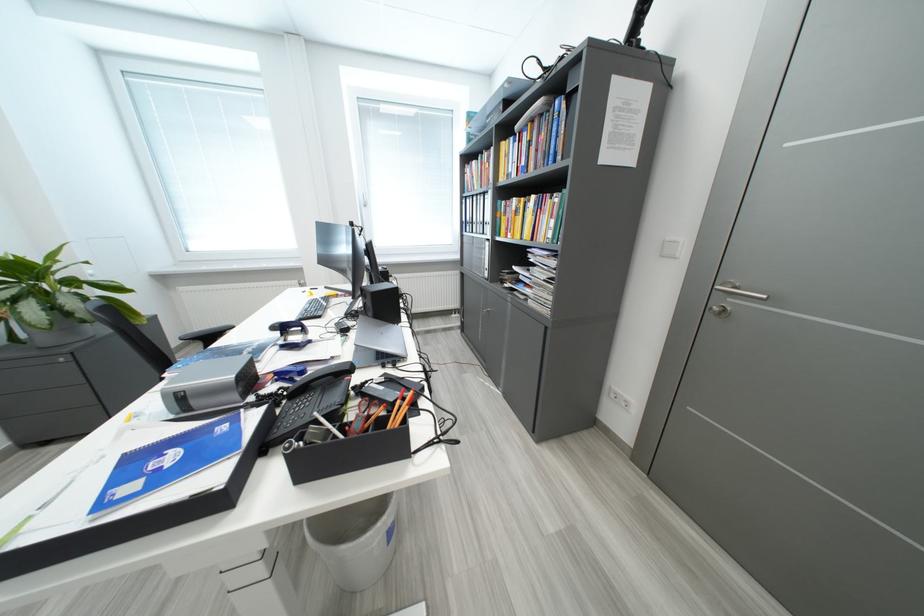
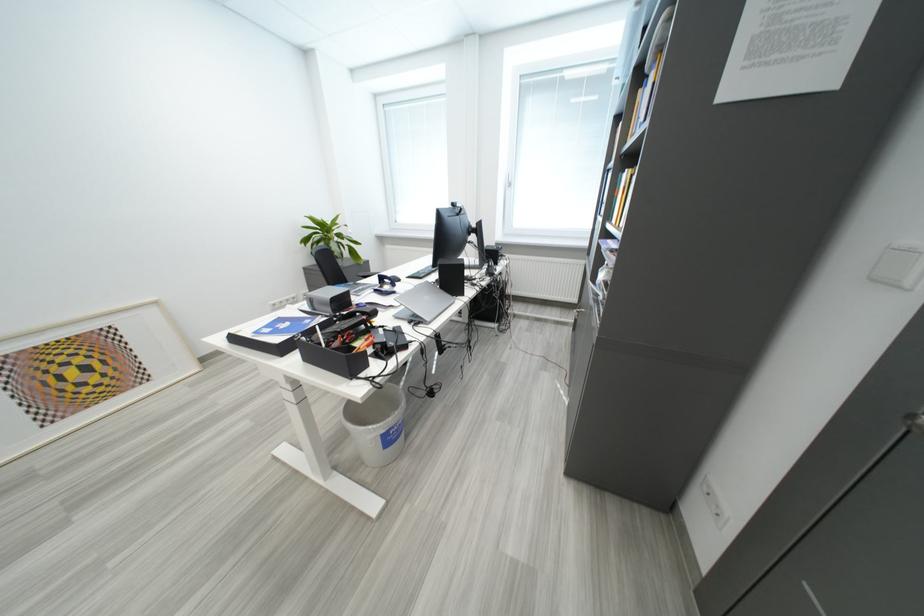
In the second image, find the point that corresponds to (x=319, y=344) in the first image.

(403, 294)